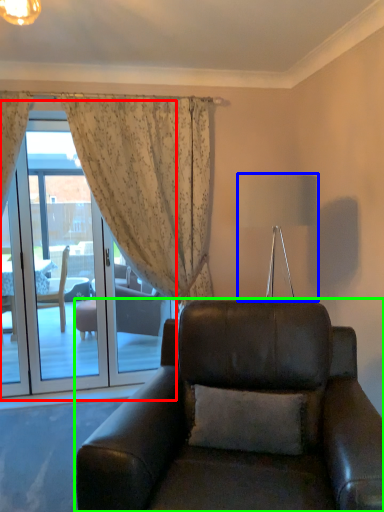
Question: Which object is the farthest from screen door (highlighted by a red box)? Choose among these: lamp (highlighted by a blue box) or chair (highlighted by a green box).

Choices:
 (A) lamp
 (B) chair

Answer: (A)